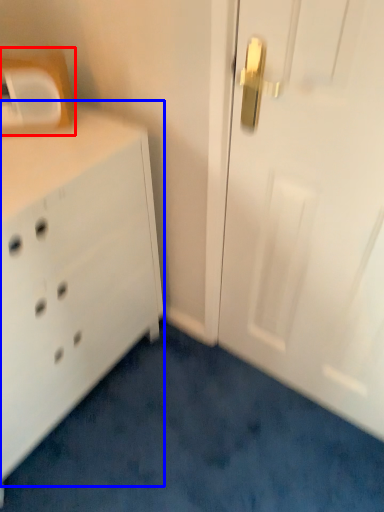
Question: Which point is further to the camera, medicine cabinet (highlighted by a red box) or chest of drawers (highlighted by a blue box)?

Choices:
 (A) medicine cabinet
 (B) chest of drawers

Answer: (A)